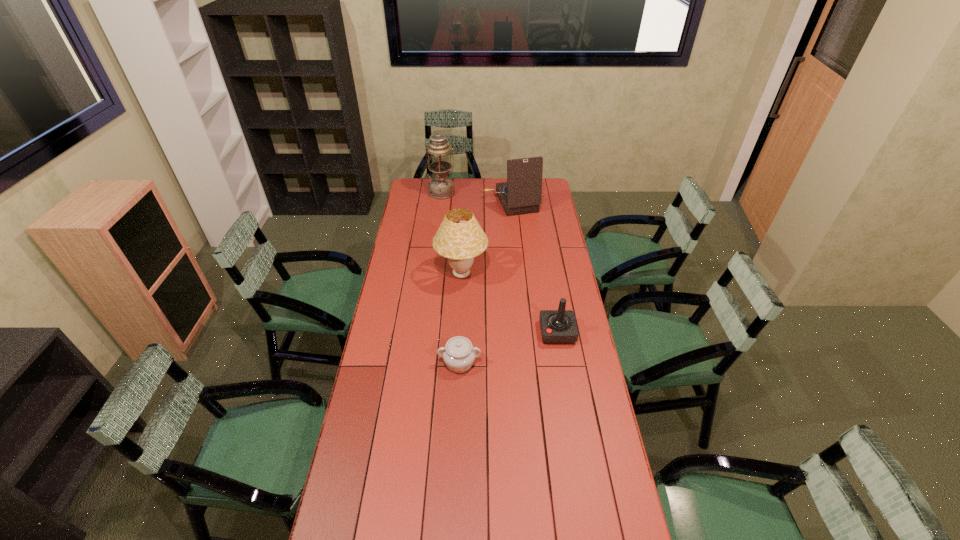
This screenshot has height=540, width=960. What are the coordinates of `oil lamp` in the screenshot? It's located at (441, 186).

Find the location of a particular element. This screenshot has width=960, height=540. the third farthest object is located at coordinates (460, 238).

Find the location of `phonograph record`. phonograph record is located at coordinates (522, 193).

Where is `joystick`? This screenshot has height=540, width=960. joystick is located at coordinates (559, 326).

Image resolution: width=960 pixels, height=540 pixels. Find the location of `the second shortest object`. the second shortest object is located at coordinates (559, 326).

Find the location of `the nearest object`. the nearest object is located at coordinates (459, 354).

This screenshot has height=540, width=960. I want to click on chinaware, so click(459, 354).

Where is `vacant space located on the front of the oil lamp`? Image resolution: width=960 pixels, height=540 pixels. vacant space located on the front of the oil lamp is located at coordinates (440, 209).

Where is `vacant space located on the back of the third farthest object`? This screenshot has height=540, width=960. vacant space located on the back of the third farthest object is located at coordinates (463, 246).

The height and width of the screenshot is (540, 960). I want to click on free space located 0.050m on the left of the phonograph record, so click(475, 203).